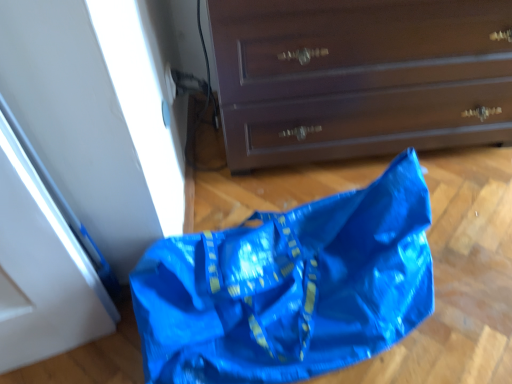
Image resolution: width=512 pixels, height=384 pixels. Describe the element at coordinates (359, 77) in the screenshot. I see `matte brown chest of drawers at center` at that location.

Identify the location of matte brown chest of drawers at center. (359, 77).

Describe the element at coordinates (289, 287) in the screenshot. The height and width of the screenshot is (384, 512). I see `blue plastic bag at lower left` at that location.

Identify the location of blue plastic bag at lower left. (289, 287).

Where is `matte brown chest of drawers at center`? matte brown chest of drawers at center is located at coordinates (359, 77).

Which is more to the right, blue plastic bag at lower left or matte brown chest of drawers at center?

matte brown chest of drawers at center.

Does blue plastic bag at lower left come in front of matte brown chest of drawers at center?

Yes, it is.

Which is in front, point (205, 347) or point (234, 110)?

Point (205, 347)

From the image's perspective, which is above, blue plastic bag at lower left or matte brown chest of drawers at center?

matte brown chest of drawers at center.

From a real-world perspective, is blue plastic bag at lower left above or below matte brown chest of drawers at center?

blue plastic bag at lower left is situated lower than matte brown chest of drawers at center in the real world.

Is blue plastic bag at lower left thinner than matte brown chest of drawers at center?

Yes, blue plastic bag at lower left is thinner than matte brown chest of drawers at center.

Does blue plastic bag at lower left have a greater height compared to matte brown chest of drawers at center?

In fact, blue plastic bag at lower left may be shorter than matte brown chest of drawers at center.

Can you confirm if blue plastic bag at lower left is bigger than matte brown chest of drawers at center?

No, blue plastic bag at lower left is not bigger than matte brown chest of drawers at center.

Would you say matte brown chest of drawers at center is part of blue plastic bag at lower left's contents?

No, matte brown chest of drawers at center is located outside of blue plastic bag at lower left.

Is there a large distance between blue plastic bag at lower left and matte brown chest of drawers at center?

blue plastic bag at lower left is actually quite close to matte brown chest of drawers at center.

Is matte brown chest of drawers at center at the back of blue plastic bag at lower left?

Yes, blue plastic bag at lower left is facing away from matte brown chest of drawers at center.

Identify the location of grocery bag in front of the matte brown chest of drawers at center. (289, 287).

Which object is positioned more to the right, matte brown chest of drawers at center or blue plastic bag at lower left?

matte brown chest of drawers at center.

Is matte brown chest of drawers at center in front of or behind blue plastic bag at lower left in the image?

Clearly, matte brown chest of drawers at center is behind blue plastic bag at lower left.

Does point (496, 72) lie behind point (200, 293)?

That is True.

From the image's perspective, is matte brown chest of drawers at center under blue plastic bag at lower left?

Actually, matte brown chest of drawers at center appears above blue plastic bag at lower left in the image.

From a real-world perspective, is matte brown chest of drawers at center positioned above or below blue plastic bag at lower left?

matte brown chest of drawers at center is above blue plastic bag at lower left.

Considering the sizes of objects matte brown chest of drawers at center and blue plastic bag at lower left in the image provided, who is wider, matte brown chest of drawers at center or blue plastic bag at lower left?

With larger width is matte brown chest of drawers at center.

Between matte brown chest of drawers at center and blue plastic bag at lower left, which one has less height?

A: blue plastic bag at lower left is shorter.

Between matte brown chest of drawers at center and blue plastic bag at lower left, which one has smaller size?

With smaller size is blue plastic bag at lower left.

Is matte brown chest of drawers at center located outside blue plastic bag at lower left?

Absolutely, matte brown chest of drawers at center is external to blue plastic bag at lower left.

Is the surface of matte brown chest of drawers at center in direct contact with blue plastic bag at lower left?

No, matte brown chest of drawers at center is not making contact with blue plastic bag at lower left.

Is matte brown chest of drawers at center aimed at blue plastic bag at lower left?

Yes, matte brown chest of drawers at center is oriented towards blue plastic bag at lower left.

Consider the image. How many degrees apart are the facing directions of matte brown chest of drawers at center and blue plastic bag at lower left?

The angular difference between matte brown chest of drawers at center and blue plastic bag at lower left is 10.5 degrees.

How much distance is there between matte brown chest of drawers at center and blue plastic bag at lower left?

matte brown chest of drawers at center is 13.16 inches from blue plastic bag at lower left.

In order to click on grocery bag located underneath the matte brown chest of drawers at center (from a real-world perspective) in this screenshot , I will do `click(289, 287)`.

Identify the location of the chest of drawers that is behind the blue plastic bag at lower left. The width and height of the screenshot is (512, 384). (359, 77).

Where is `grocery bag in front of the matte brown chest of drawers at center`? Image resolution: width=512 pixels, height=384 pixels. grocery bag in front of the matte brown chest of drawers at center is located at coordinates (289, 287).